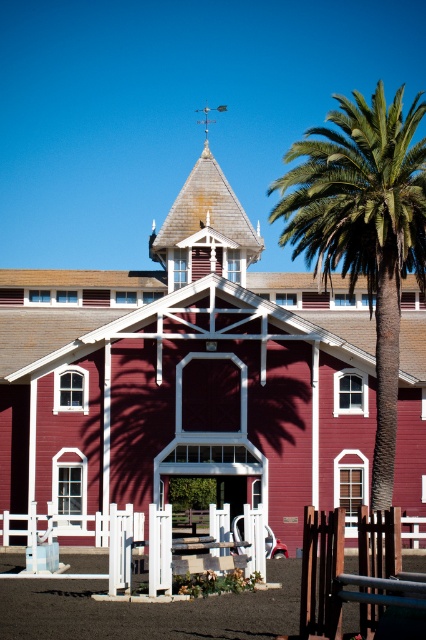
You are a farmer standing in front of the matte red barn at center and the green leafy palm at right. You want to hang a birdhouse on the taller object. Which one should you choose?

The green leafy palm at right is taller than the matte red barn at center, so you should hang the birdhouse on the green leafy palm at right.

You are standing in a field looking at the matte red barn at center and the green leafy palm at right. Which object appears closer to you based on their sizes?

The matte red barn at center appears closer because it is smaller than the green leafy palm at right, which is farther away.